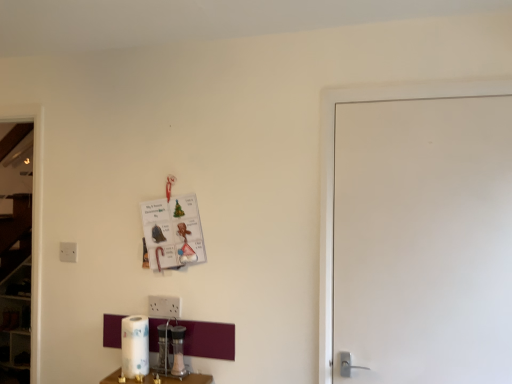
The width and height of the screenshot is (512, 384). What do you see at coordinates (135, 347) in the screenshot?
I see `white glossy paper towel at lower center` at bounding box center [135, 347].

What is the approximate width of white matte door at right?

It is 7.37 centimeters.

Where is `metallic silver salt shaker at lower center`? metallic silver salt shaker at lower center is located at coordinates (188, 379).

Locate an element on the screen. This screenshot has height=384, width=512. white plastic electric outlet at left is located at coordinates (68, 252).

Is white matte door at right positioned far away from white plastic electric outlet at left?

Yes, white matte door at right and white plastic electric outlet at left are located far from each other.

Is point (429, 340) positioned behind point (69, 250)?

No, (429, 340) is closer to viewer.

From a real-world perspective, between white matte door at right and white plastic electric outlet at left, who is vertically lower?

white plastic electric outlet at left is physically lower.

From the image's perspective, is white plastic electric outlet at left under white matte door at right?

Yes, from the image's perspective, white plastic electric outlet at left is below white matte door at right.

Is white plastic electric outlet at left positioned behind white matte door at right?

That is True.

Based on their positions, is white plastic electric outlet at left located to the left or right of white matte door at right?

Based on their positions, white plastic electric outlet at left is located to the left of white matte door at right.

Looking at their sizes, would you say white matte door at right is wider or thinner than metallic silver salt shaker at lower center?

In the image, white matte door at right appears to be more narrow than metallic silver salt shaker at lower center.

Does white matte door at right appear on the left side of metallic silver salt shaker at lower center?

Incorrect, white matte door at right is not on the left side of metallic silver salt shaker at lower center.

Can you confirm if white matte door at right is smaller than metallic silver salt shaker at lower center?

No, white matte door at right is not smaller than metallic silver salt shaker at lower center.

Does white matte door at right lie behind white glossy paper towel at lower center?

No, it is not.

Considering the relative sizes of white matte door at right and white glossy paper towel at lower center in the image provided, is white matte door at right smaller than white glossy paper towel at lower center?

No, white matte door at right is not smaller than white glossy paper towel at lower center.

From a real-world perspective, does white matte door at right sit lower than white glossy paper towel at lower center?

No, from a real-world perspective, white matte door at right is not beneath white glossy paper towel at lower center.

Identify the location of paper towel on the left of the white matte door at right. (135, 347).

Looking at this image, is metallic silver salt shaker at lower center facing away from white glossy paper towel at lower center?

That's not correct — metallic silver salt shaker at lower center is not looking away from white glossy paper towel at lower center.

Does point (168, 379) appear closer or farther from the camera than point (125, 372)?

Point (168, 379) is positioned closer to the camera compared to point (125, 372).

Can metallic silver salt shaker at lower center be found inside white plastic electric outlet at left?

No, metallic silver salt shaker at lower center is located outside of white plastic electric outlet at left.

From a real-world perspective, is white plastic electric outlet at left positioned over metallic silver salt shaker at lower center based on gravity?

Yes.

Is white plastic electric outlet at left positioned far away from metallic silver salt shaker at lower center?

No, white plastic electric outlet at left is in close proximity to metallic silver salt shaker at lower center.

At what (x,y) coordinates should I click in order to perform the action: click on electric outlet on the left of metallic silver salt shaker at lower center. Please return your answer as a coordinate pair (x, y). Image resolution: width=512 pixels, height=384 pixels. Looking at the image, I should click on (68, 252).

Is white glossy paper towel at lower center oriented towards white matte door at right?

No, white glossy paper towel at lower center does not turn towards white matte door at right.

Can you confirm if white glossy paper towel at lower center is shorter than white matte door at right?

Indeed, white glossy paper towel at lower center has a lesser height compared to white matte door at right.

Between point (138, 352) and point (397, 370), which one is positioned behind?

The point (138, 352) is behind.

In the scene shown: Which object is closer to the camera, white glossy paper towel at lower center or white matte door at right?

white matte door at right is more forward.

Locate an element on the screen. door above the white plastic electric outlet at left (from the image's perspective) is located at coordinates (423, 240).

Where is `electric outlet that appears below the white matte door at right (from a real-world perspective)`? The height and width of the screenshot is (384, 512). electric outlet that appears below the white matte door at right (from a real-world perspective) is located at coordinates (68, 252).

Looking at the image, which one is located closer to white matte door at right, white plastic electric outlet at left or metallic silver salt shaker at lower center?

Based on the image, metallic silver salt shaker at lower center appears to be nearer to white matte door at right.

Looking at this image, when comparing their distances from metallic silver salt shaker at lower center, does white glossy paper towel at lower center or white matte door at right seem closer?

white glossy paper towel at lower center is closer to metallic silver salt shaker at lower center.

Considering their positions, is white glossy paper towel at lower center positioned further to white plastic electric outlet at left than white matte door at right?

white matte door at right is positioned further to the anchor white plastic electric outlet at left.

Considering their positions, is white matte door at right positioned closer to white glossy paper towel at lower center than metallic silver salt shaker at lower center?

metallic silver salt shaker at lower center is closer to white glossy paper towel at lower center.

Estimate the real-world distances between objects in this image. Which object is closer to white glossy paper towel at lower center, metallic silver salt shaker at lower center or white matte door at right?

metallic silver salt shaker at lower center.

Considering their positions, is white plastic electric outlet at left positioned further to white glossy paper towel at lower center than metallic silver salt shaker at lower center?

white plastic electric outlet at left.

Which object lies nearer to the anchor point metallic silver salt shaker at lower center, white plastic electric outlet at left or white glossy paper towel at lower center?

Among the two, white glossy paper towel at lower center is located nearer to metallic silver salt shaker at lower center.

From the image, which object appears to be nearer to white matte door at right, white plastic electric outlet at left or white glossy paper towel at lower center?

Among the two, white glossy paper towel at lower center is located nearer to white matte door at right.

The image size is (512, 384). Find the location of `furniture between white plastic electric outlet at left and white matte door at right in the horizontal direction`. furniture between white plastic electric outlet at left and white matte door at right in the horizontal direction is located at coordinates point(188,379).

Where is `paper towel between white plastic electric outlet at left and metallic silver salt shaker at lower center in the vertical direction`? Image resolution: width=512 pixels, height=384 pixels. paper towel between white plastic electric outlet at left and metallic silver salt shaker at lower center in the vertical direction is located at coordinates (135, 347).

Where is `paper towel located between white plastic electric outlet at left and white matte door at right in the left-right direction`? The width and height of the screenshot is (512, 384). paper towel located between white plastic electric outlet at left and white matte door at right in the left-right direction is located at coordinates (135, 347).

You are a GUI agent. You are given a task and a screenshot of the screen. Output one action in this format:
    pyautogui.click(x=<x>, y=<y>)
    Task: Click on the furniture located between white glossy paper towel at lower center and white matte door at right in the left-right direction
    Image resolution: width=512 pixels, height=384 pixels.
    Given the screenshot: What is the action you would take?
    pyautogui.click(x=188, y=379)